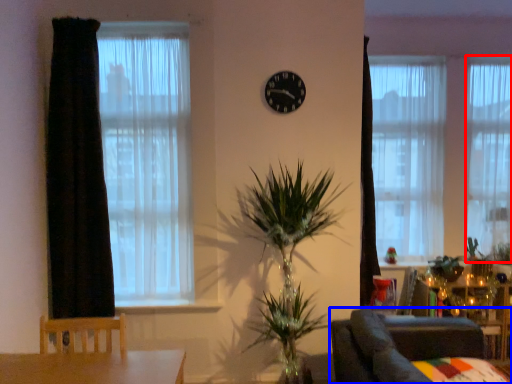
Question: Which of the following is the closest to the observer, curtain (highlighted by a red box) or furniture (highlighted by a blue box)?

Choices:
 (A) curtain
 (B) furniture

Answer: (B)